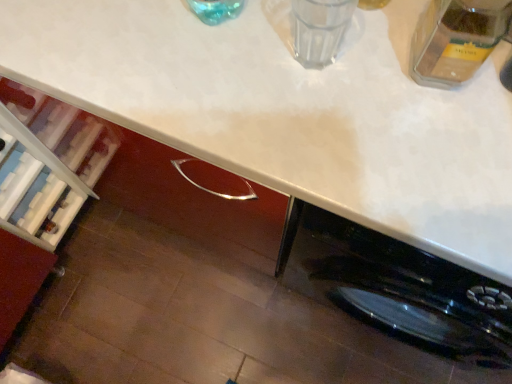
Question: Is white glossy countertop at upper center situated inside transparent glass jar at upper right or outside?

Choices:
 (A) outside
 (B) inside

Answer: (A)

Question: Considering the positions of white glossy countertop at upper center and transparent glass jar at upper right in the image, is white glossy countertop at upper center taller or shorter than transparent glass jar at upper right?

Choices:
 (A) short
 (B) tall

Answer: (B)

Question: Which object is positioned closest to the transparent glass jar at upper right?

Choices:
 (A) white glossy countertop at upper center
 (B) transparent glass at upper center

Answer: (B)

Question: Estimate the real-world distances between objects in this image. Which object is farther from the transparent glass jar at upper right?

Choices:
 (A) white glossy countertop at upper center
 (B) transparent glass at upper center

Answer: (A)